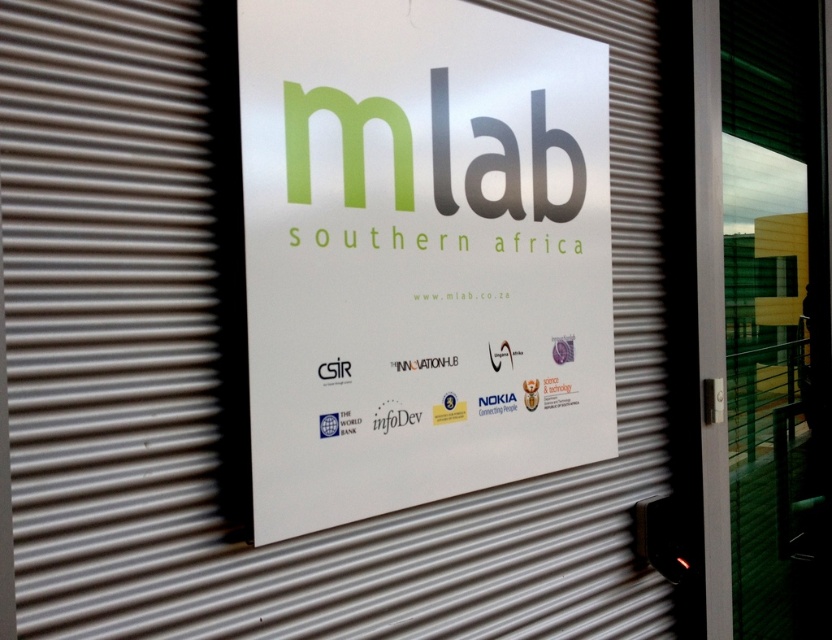
You are standing 5 feet away from the signboard. If you move forward 0.66 feet, will you be closer than the point at point (558, 285)?

The distance of point (558, 285) from viewer is 4.34 feet. After moving forward 0.66 feet, you will be 4.34 feet minus 0.66 feet equals 3.68 feet away from the signboard. Since 3.68 feet is less than 4.34 feet, you will be closer than the point at point (558, 285).

From the picture: You are standing in front of the signboard and want to touch both the white paper sign at center and the transparent glass screen door at right. What is the minimum distance you need to move your hand to reach both objects?

The minimum distance you need to move your hand is 30.33 inches, as that is the distance between the white paper sign at center and the transparent glass screen door at right.

In the scene shown: You are standing in front of the signboard and need to read both the white paper sign at center and the transparent glass screen door at right. Which one do you need to look down more to see?

The white paper sign at center has a lesser height compared to the transparent glass screen door at right, so you need to look down more to see the white paper sign at center.